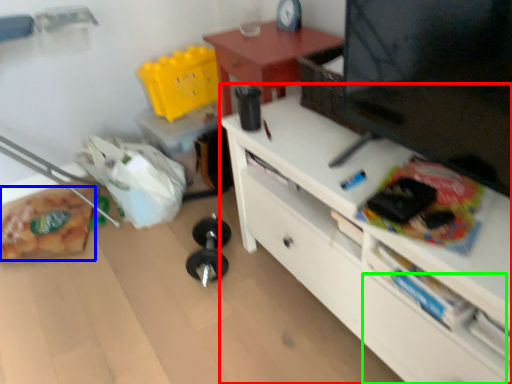
Question: Considering the real-world distances, which object is farthest from desk (highlighted by a red box)? stuff (highlighted by a blue box) or drawer (highlighted by a green box)?

Choices:
 (A) stuff
 (B) drawer

Answer: (A)